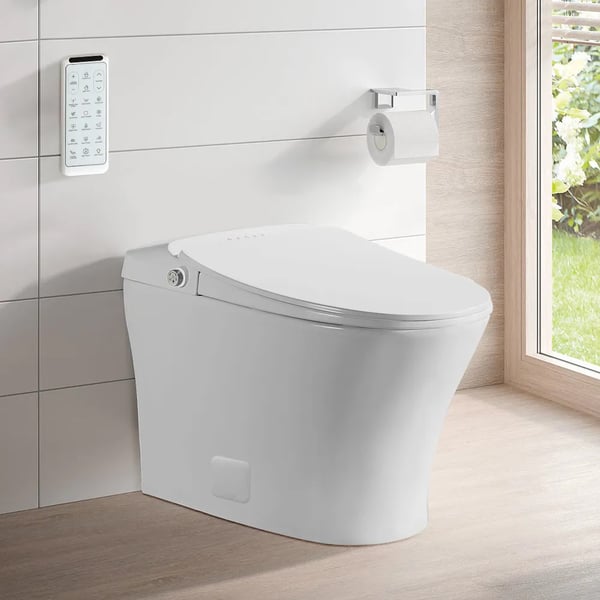
This screenshot has height=600, width=600. What are the coordinates of `window frame` in the screenshot? It's located at (531, 150).